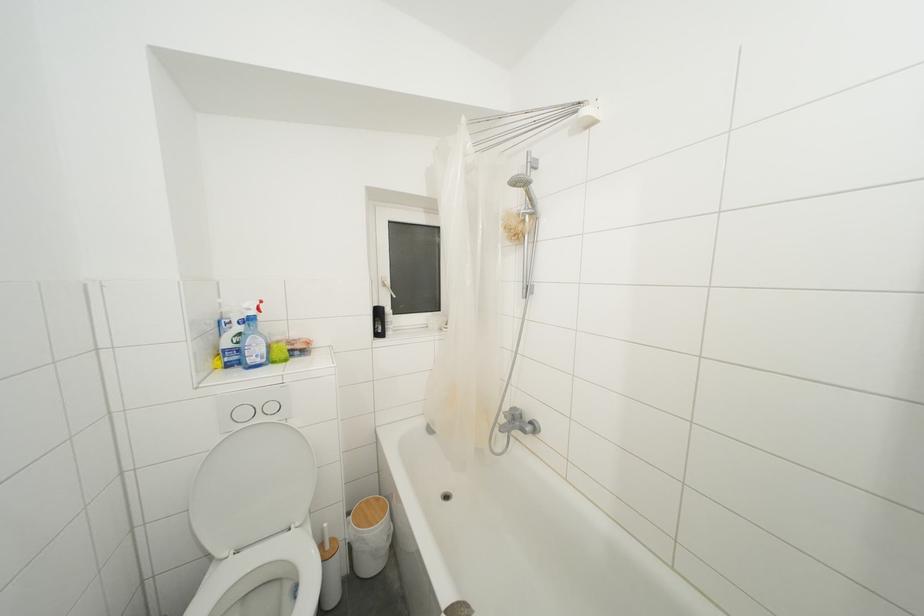
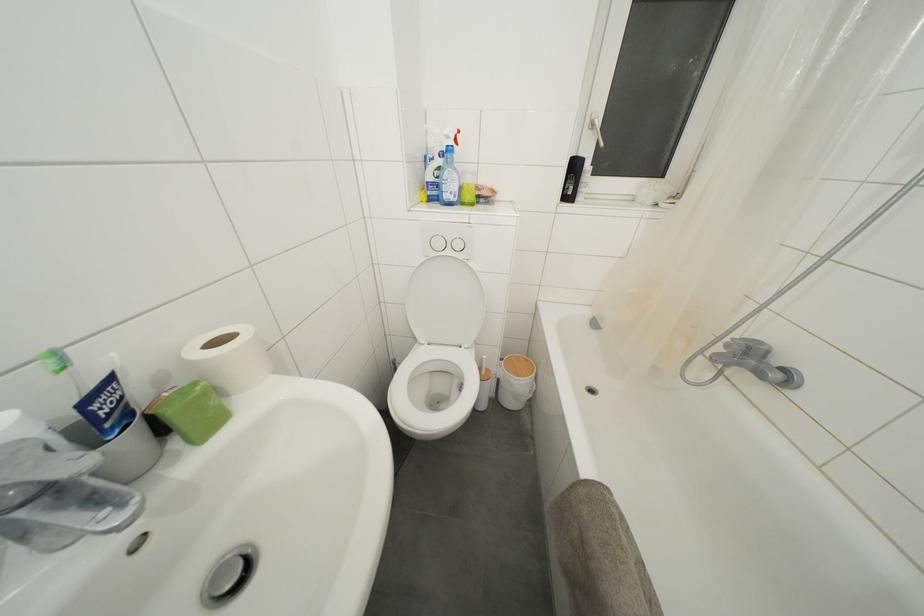
Locate, in the second image, the point that corresponds to point (332, 552) in the first image.

(488, 378)